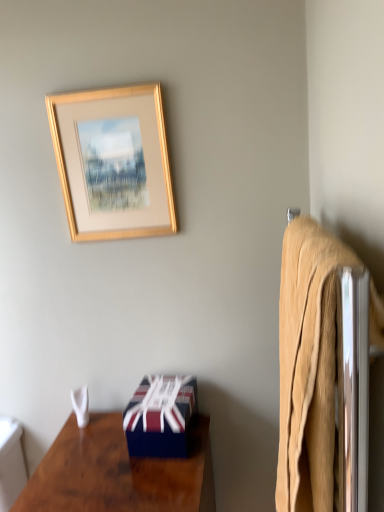
The width and height of the screenshot is (384, 512). Identify the location of free spot in front of blue glossy box at lower center. (148, 479).